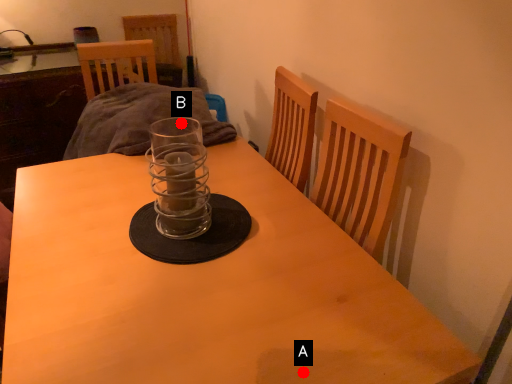
Question: Two points are circled on the image, labeled by A and B beside each circle. Which of the following is the farthest from the observer?

Choices:
 (A) A is further
 (B) B is further

Answer: (B)